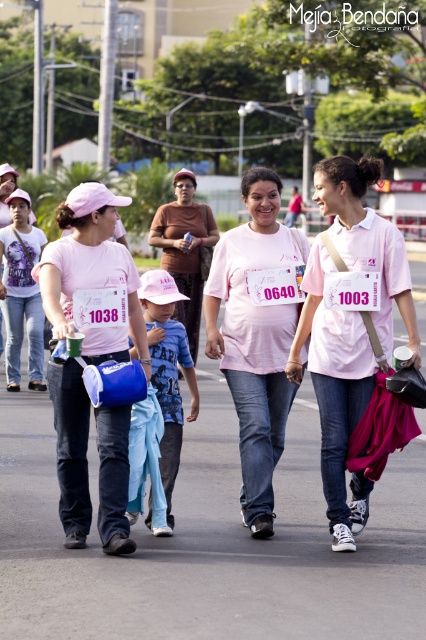
You are a photographer positioned at the center of the scene. You want to take a photo that includes both the point at coordinates point (166, 320) and point (190, 346). Which point will appear larger in the photo?

Point (166, 320) is closer to the camera than point (190, 346), so it will appear larger in the photo.